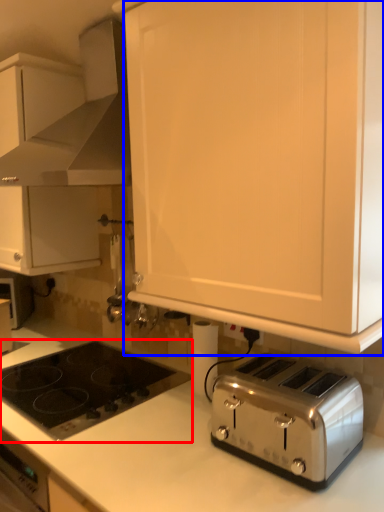
Question: Which object appears farthest to the camera in this image, gas stove (highlighted by a red box) or cabinetry (highlighted by a blue box)?

Choices:
 (A) gas stove
 (B) cabinetry

Answer: (A)